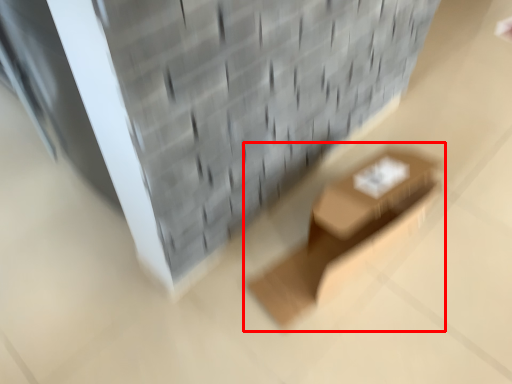
Question: Considering the relative positions of furniture (annotated by the red box) and brickwork in the image provided, where is furniture (annotated by the red box) located with respect to the staircase?

Choices:
 (A) left
 (B) right

Answer: (B)